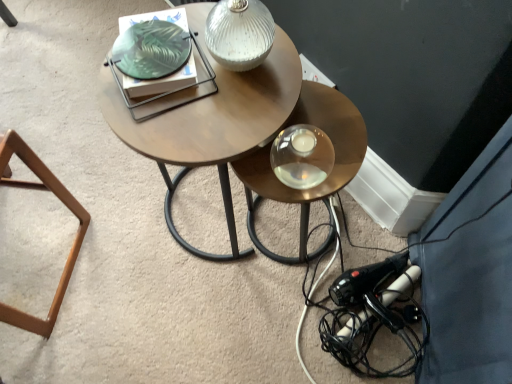
Question: Is white textured glass table lamp at upper center taller or shorter than black plastic hairdryer at lower right?

Choices:
 (A) tall
 (B) short

Answer: (A)

Question: From the image's perspective, relative to black plastic hairdryer at lower right, is white textured glass table lamp at upper center above or below?

Choices:
 (A) below
 (B) above

Answer: (B)

Question: Estimate the real-world distances between objects in this image. Which object is farther from the metallic gold table at center?

Choices:
 (A) white textured glass table lamp at upper center
 (B) woodenmaterial/texturecoffee table at center
 (C) black plastic hairdryer at lower right
 (D) brown wooden stool at lower left

Answer: (D)

Question: Considering the real-world distances, which object is closest to the woodenmaterial/texturecoffee table at center?

Choices:
 (A) brown wooden stool at lower left
 (B) black plastic hairdryer at lower right
 (C) metallic gold table at center
 (D) white textured glass table lamp at upper center

Answer: (D)